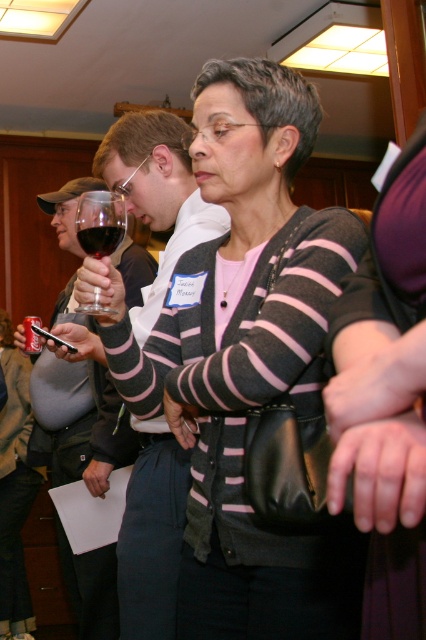
Question: Is matte black sweater at center smaller than matte black wine glass at left?

Choices:
 (A) no
 (B) yes

Answer: (B)

Question: Is matte black wine glass at upper left below transparent glass at upper center?

Choices:
 (A) yes
 (B) no

Answer: (B)

Question: Among these objects, which one is nearest to the camera?

Choices:
 (A) matte black wine glass at left
 (B) dark red liquid at upper left

Answer: (B)

Question: From the image, what is the correct spatial relationship of matte black sweater at center in relation to matte black wine glass at left?

Choices:
 (A) above
 (B) below

Answer: (A)

Question: Which of the following is the farthest from the observer?

Choices:
 (A) matte black sweater at center
 (B) dark red liquid at upper left
 (C) matte black wine glass at upper left

Answer: (C)

Question: Among these objects, which one is nearest to the camera?

Choices:
 (A) matte black sweater at center
 (B) matte black wine glass at left
 (C) dark red liquid at upper left

Answer: (A)